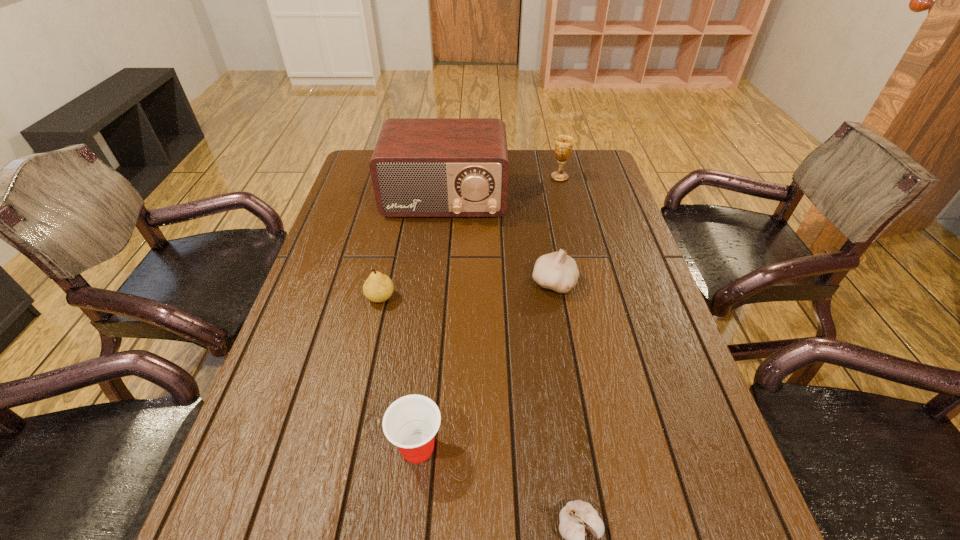
Locate an element on the screen. The width and height of the screenshot is (960, 540). radio receiver is located at coordinates (421, 167).

Where is `the fifth shortest object`? The image size is (960, 540). the fifth shortest object is located at coordinates (563, 146).

What are the coordinates of `the farther garlic` in the screenshot? It's located at (557, 271).

The height and width of the screenshot is (540, 960). I want to click on pear, so click(378, 287).

Where is `the second nearest object`? the second nearest object is located at coordinates (411, 422).

Locate an element on the screen. Image resolution: width=960 pixels, height=540 pixels. blank space located 0.330m on the front panel of the radio receiver is located at coordinates tap(434, 304).

Where is `free space located on the left of the second tallest object`? Image resolution: width=960 pixels, height=540 pixels. free space located on the left of the second tallest object is located at coordinates (439, 177).

What are the coordinates of `free space located 0.350m on the back of the taller garlic` in the screenshot? It's located at (539, 197).

Find the location of a particular element. vacant space located on the front of the pear is located at coordinates (354, 415).

Identify the location of vacant area situated 0.210m on the left of the cup. This screenshot has height=540, width=960. (281, 448).